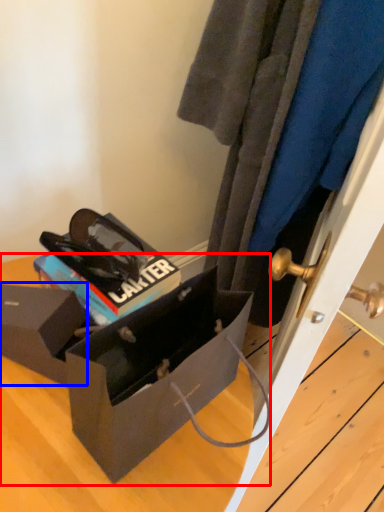
Question: Among these objects, which one is nearest to the camera, box (highlighted by a red box) or box (highlighted by a blue box)?

Choices:
 (A) box
 (B) box

Answer: (A)